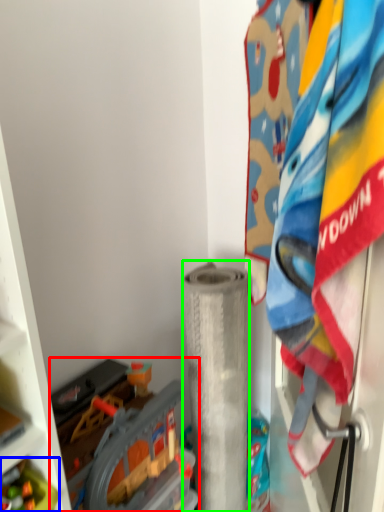
Question: Estimate the real-world distances between objects in this image. Which object is closer to toy (highlighted by a red box), toy (highlighted by a blue box) or toilet paper (highlighted by a green box)?

Choices:
 (A) toy
 (B) toilet paper

Answer: (B)